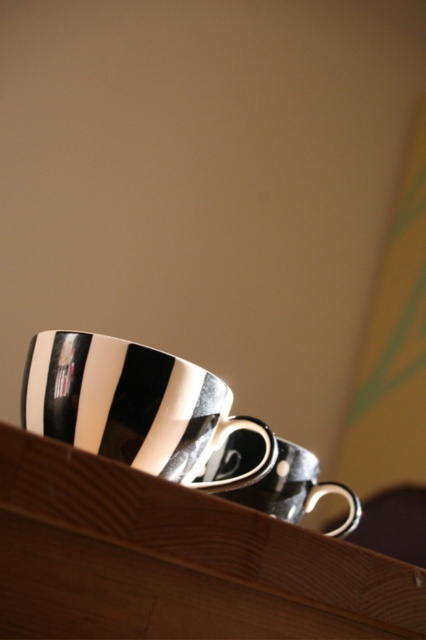
You are a photographer trying to capture a closeup of the wooden shelf at upper center. Your camera is currently positioned 25.94 centimeters away from the shelf. Is this distance sufficient to ensure the entire shelf fits within the frame?

The wooden shelf at upper center and camera are 25.94 centimeters apart, so the distance is sufficient to ensure the entire shelf fits within the frame.

You are arranging items on a wooden shelf at upper center and a black glossy mug at upper center. Which object is located to the right of the other?

The wooden shelf at upper center is positioned on the right side of black glossy mug at upper center, so the wooden shelf at upper center is to the right of the black glossy mug at upper center.